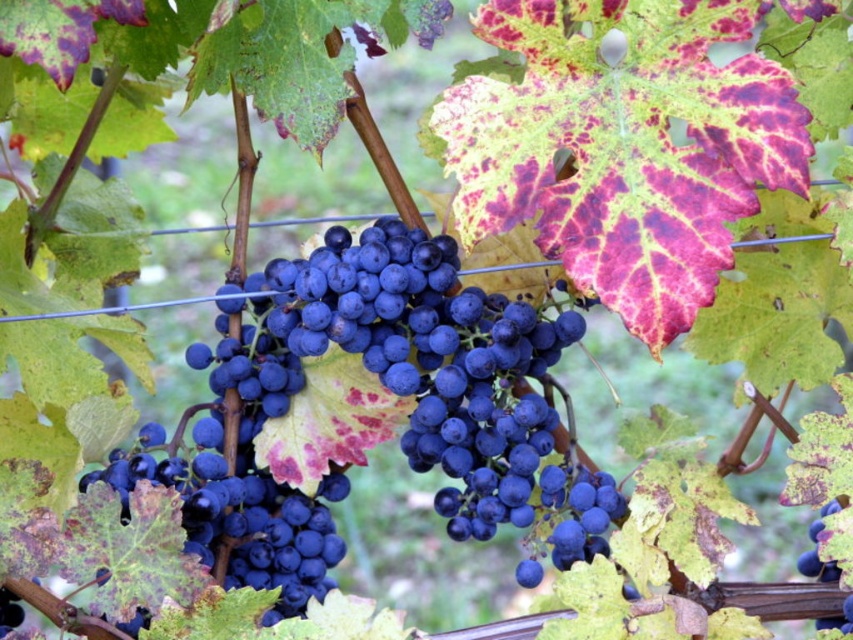
At what (x,y) coordinates should I click in order to perform the action: click on shiny dark blue grapes at center. Please return your answer as a coordinate pair (x, y). Image resolution: width=853 pixels, height=640 pixels. Looking at the image, I should click on (386, 388).

Does shiny dark blue grapes at center appear under blue matte grape at center?

No, shiny dark blue grapes at center is not below blue matte grape at center.

Between point (401, 372) and point (828, 561), which one is positioned behind?

Point (828, 561)

Locate an element on the screen. The image size is (853, 640). shiny dark blue grapes at center is located at coordinates (386, 388).